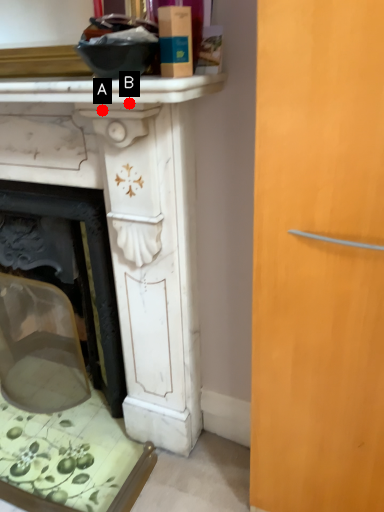
Question: Two points are circled on the image, labeled by A and B beside each circle. Which point is farther from the camera taking this photo?

Choices:
 (A) A is further
 (B) B is further

Answer: (A)